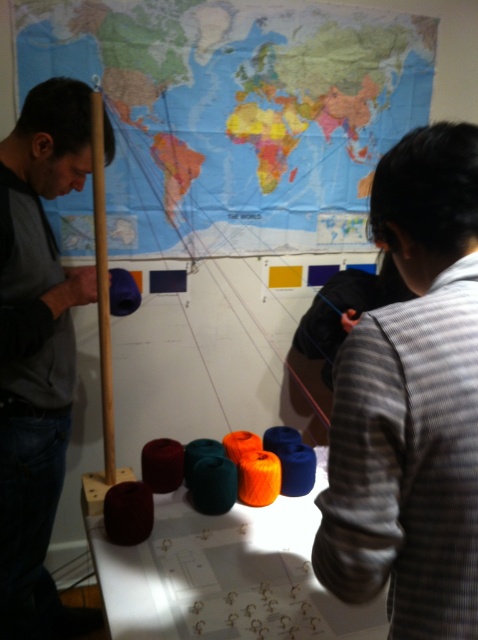
Question: Is striped fabric at upper right below matte blue yarn at center?

Choices:
 (A) no
 (B) yes

Answer: (B)

Question: Observing the image, what is the correct spatial positioning of striped fabric at upper right in reference to matte blue yarn at center?

Choices:
 (A) right
 (B) left

Answer: (A)

Question: Which of the following is the farthest from the observer?

Choices:
 (A) [x=152, y=116]
 (B) [x=99, y=182]
 (C) [x=434, y=356]

Answer: (A)

Question: Estimate the real-world distances between objects in this image. Which object is farther from the matte gray sweater at left?

Choices:
 (A) striped fabric at upper right
 (B) map at upper center
 (C) matte blue yarn at center

Answer: (A)

Question: Can you confirm if map at upper center is positioned to the right of striped fabric at upper right?

Choices:
 (A) yes
 (B) no

Answer: (B)

Question: Which of the following is the farthest from the observer?

Choices:
 (A) (99, 342)
 (B) (33, 349)
 (C) (444, 560)
 (D) (144, 170)

Answer: (D)